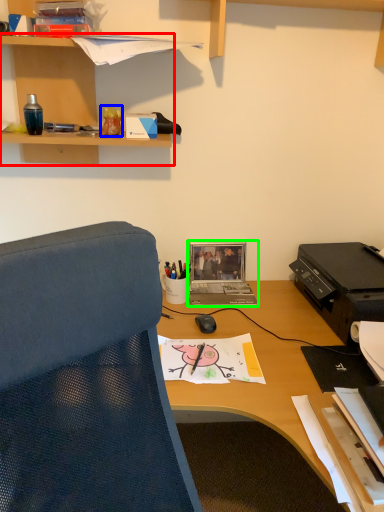
Question: Which is farther away from shelf (highlighted by a red box)? stationery (highlighted by a blue box) or laptop (highlighted by a green box)?

Choices:
 (A) stationery
 (B) laptop

Answer: (B)